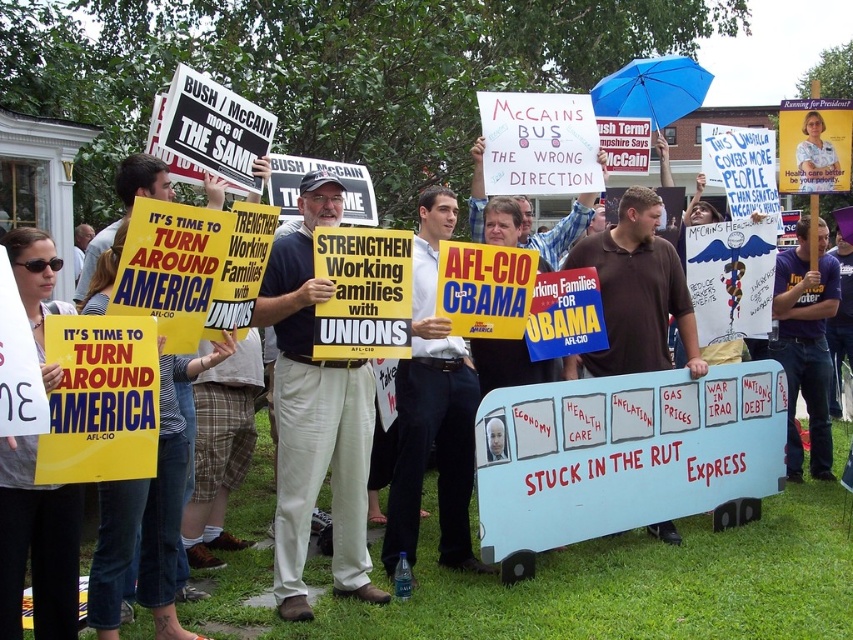
Does brown cotton shirt at center have a greater width compared to white shirt at center?

Correct, the width of brown cotton shirt at center exceeds that of white shirt at center.

Is point (624, 320) closer to viewer compared to point (817, 192)?

Yes.

Measure the distance between point (628, 368) and camera.

Point (628, 368) is 21.49 feet from camera.

Where is `brown cotton shirt at center`? This screenshot has height=640, width=853. brown cotton shirt at center is located at coordinates coord(636,292).

Can you confirm if purple cotton t-shirt at center is positioned above blue fabric umbrella at upper center?

No.

Measure the distance from purple cotton t-shirt at center to blue fabric umbrella at upper center.

purple cotton t-shirt at center is 8.59 feet from blue fabric umbrella at upper center.

Identify the location of purple cotton t-shirt at center. This screenshot has height=640, width=853. (805, 340).

Locate an element on the screen. This screenshot has width=853, height=640. purple cotton t-shirt at center is located at coordinates (805, 340).

Can you confirm if light beige pants at center is positioned to the left of white shirt at center?

Correct, you'll find light beige pants at center to the left of white shirt at center.

Can you confirm if light beige pants at center is shorter than white shirt at center?

No, light beige pants at center is not shorter than white shirt at center.

Where is `light beige pants at center`? The image size is (853, 640). light beige pants at center is located at coordinates (315, 413).